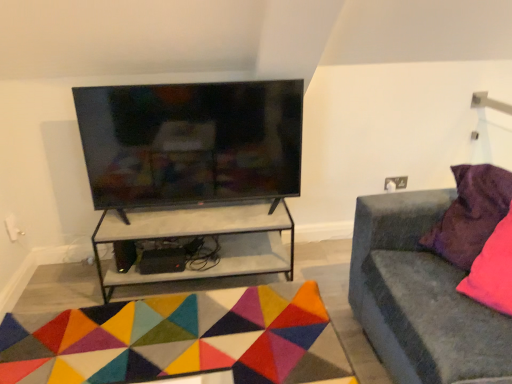
Question: Is velvet grey couch at right inside or outside of black glossy tv at upper center?

Choices:
 (A) outside
 (B) inside

Answer: (A)

Question: From the image's perspective, is velvet grey couch at right located above or below black glossy tv at upper center?

Choices:
 (A) below
 (B) above

Answer: (A)

Question: Based on their relative distances, which object is farther from the velvet grey couch at right?

Choices:
 (A) white concrete shelf at center
 (B) black glossy tv at upper center
 (C) multicolored felt mat at center
 (D) purple velvet pillow at right

Answer: (B)

Question: Which is farther from the purple velvet pillow at right?

Choices:
 (A) multicolored felt mat at center
 (B) velvet grey couch at right
 (C) black glossy tv at upper center
 (D) white concrete shelf at center

Answer: (C)